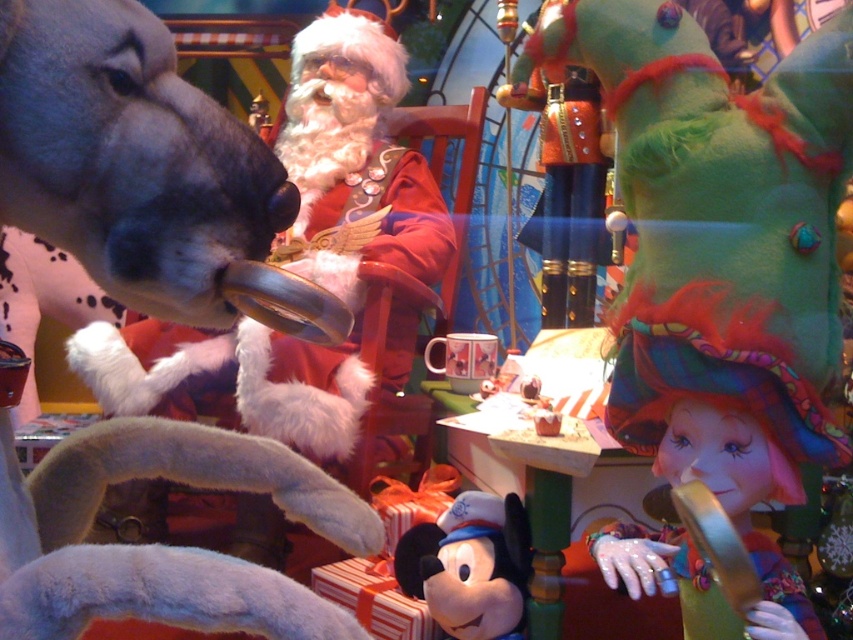
Question: Does multicolored tulle hat at lower right appear over soft plush mickey mouse at center?

Choices:
 (A) no
 (B) yes

Answer: (B)

Question: Observing the image, what is the correct spatial positioning of fuzzy red santa at center in reference to multicolored tulle hat at lower right?

Choices:
 (A) above
 (B) below

Answer: (A)

Question: Which point is farther to the camera?

Choices:
 (A) green felt hat at right
 (B) multicolored tulle hat at lower right
 (C) soft plush mickey mouse at center
 (D) fuzzy red santa at center

Answer: (D)

Question: Which point is farther from the camera taking this photo?

Choices:
 (A) (469, 557)
 (B) (711, 316)
 (C) (341, 458)

Answer: (C)

Question: Where is fuzzy red santa at center located in relation to soft plush mickey mouse at center in the image?

Choices:
 (A) above
 (B) below

Answer: (A)

Question: Estimate the real-world distances between objects in this image. Which object is closer to the fuzzy red santa at center?

Choices:
 (A) multicolored tulle hat at lower right
 (B) green felt hat at right

Answer: (B)